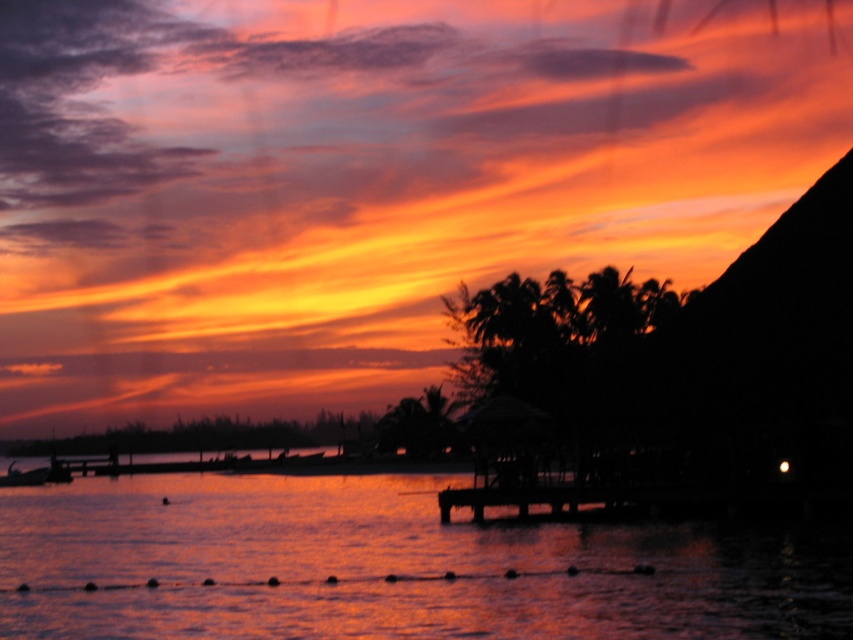
You are standing on the beach and want to walk to the dock. The path leads you past the shiny reflective water at center and the black wood dock at center. Which object will you encounter first as you walk towards the dock?

You will encounter the shiny reflective water at center first because it is wider than the black wood dock at center, meaning it spans a larger area in front of the dock.

You are standing on the beach and see the point at coordinates (392, 566). What is the most likely feature at that location?

The point at coordinates (392, 566) marks shiny reflective water at center.

You are standing on the beach and see the shiny reflective water at center and the black wood dock at center. Which object is located to the right of the other?

The black wood dock at center is to the right of the shiny reflective water at center because the shiny reflective water at center is positioned on the left side of black wood dock at center.